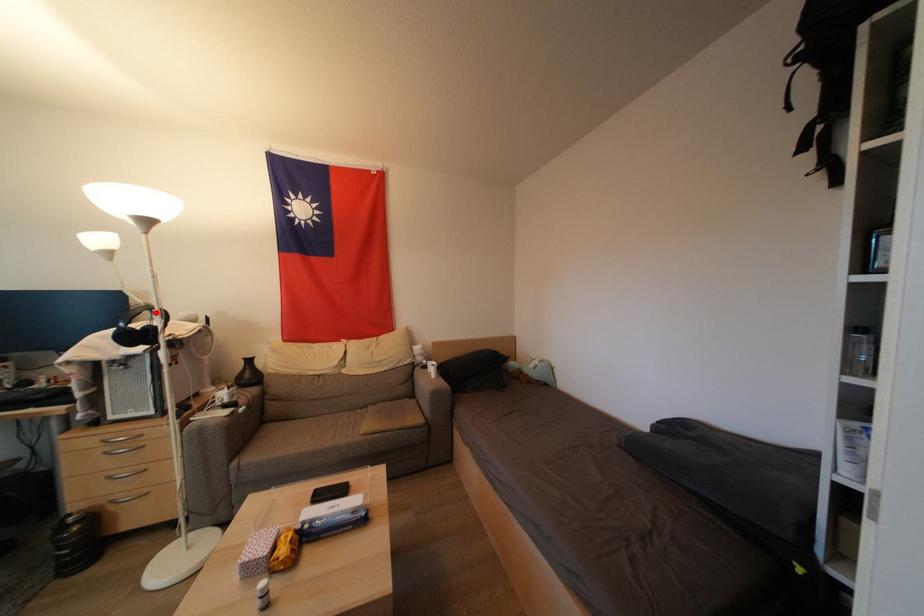
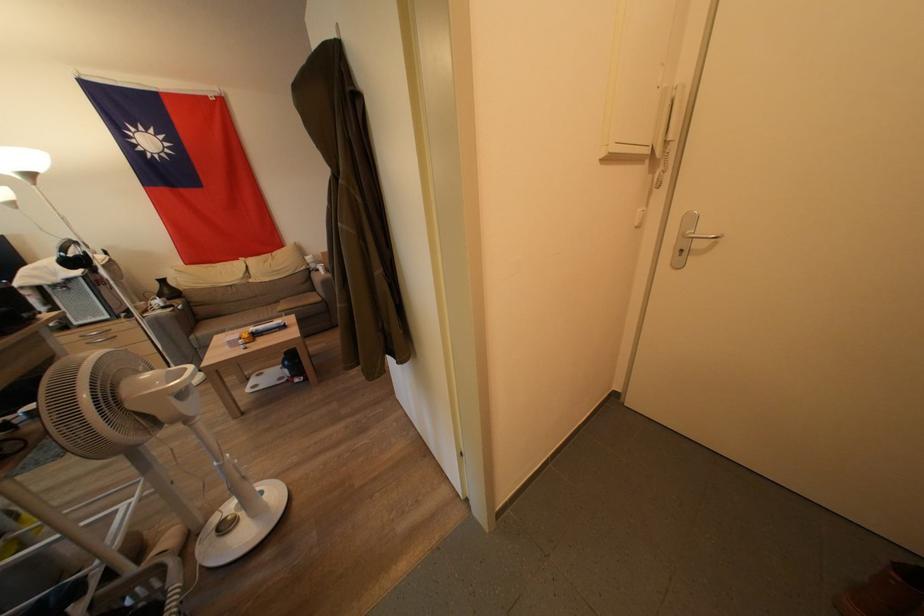
The point at the highlighted location is marked in the first image. Where is the corresponding point in the second image?

(79, 246)